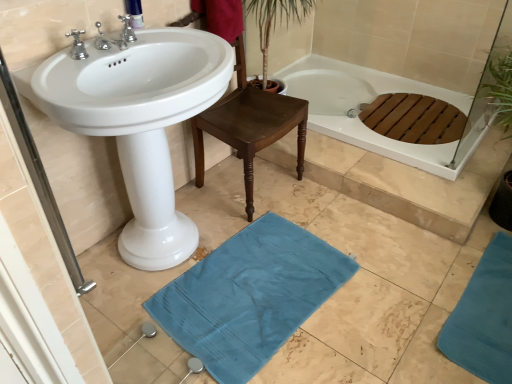
The width and height of the screenshot is (512, 384). What are the coordinates of `vacant space behind satin nickel faucet at upper left, acting as the first tap starting from the front` in the screenshot? It's located at (135, 40).